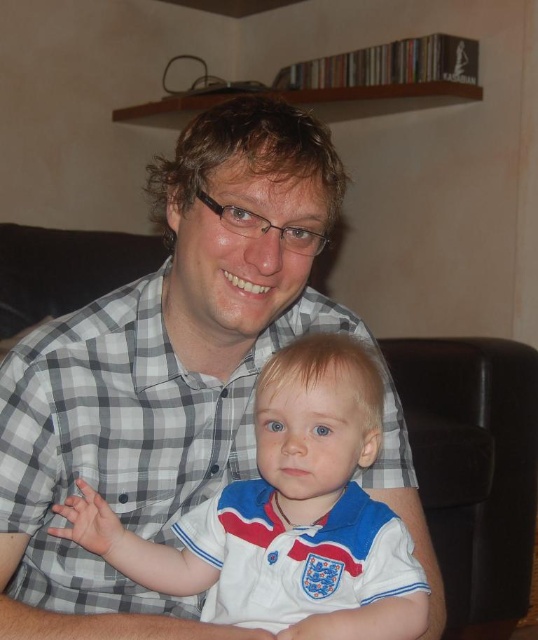
Is checkered fabric shirt at center smaller than white cotton shirt at center?

No.

Does point (45, 572) come in front of point (371, 378)?

That is False.

You are a GUI agent. You are given a task and a screenshot of the screen. Output one action in this format:
    pyautogui.click(x=<x>, y=<y>)
    Task: Click on the checkered fabric shirt at center
    
    Given the screenshot: What is the action you would take?
    pyautogui.click(x=165, y=371)

Image resolution: width=538 pixels, height=640 pixels. In order to click on checkered fabric shirt at center in this screenshot , I will do `click(165, 371)`.